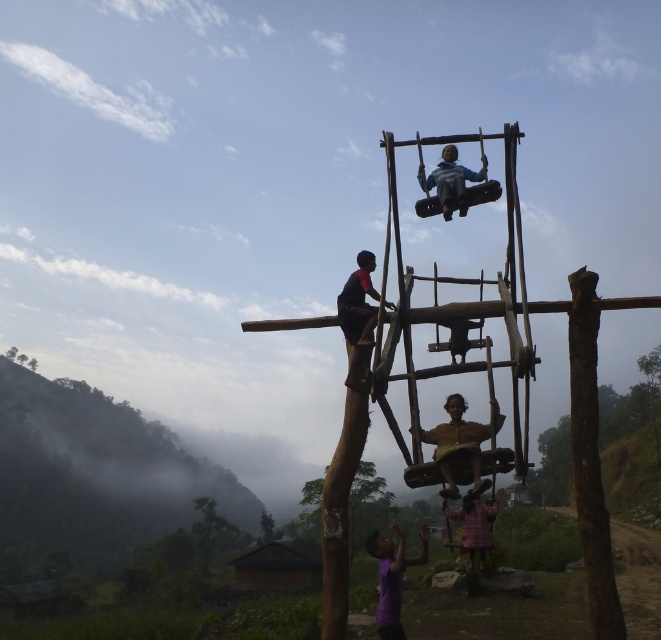
Question: Can you confirm if brown wooden swing at center is thinner than purple matte shirt at lower center?

Choices:
 (A) yes
 (B) no

Answer: (A)

Question: Which point is farther from the camera taking this photo?

Choices:
 (A) (447, 182)
 (B) (440, 454)
 (C) (377, 532)
 (D) (463, 509)

Answer: (D)

Question: Which object is the farthest from the plaid fabric child at lower center?

Choices:
 (A) purple matte shirt at lower center
 (B) brown wooden swing at center

Answer: (B)

Question: In this image, where is brown wooden swing at center located relative to plaid fabric child at lower center?

Choices:
 (A) below
 (B) above

Answer: (B)

Question: Which object is positioned closest to the purple matte shirt at lower center?

Choices:
 (A) blue striped shirt at upper center
 (B) plaid fabric child at lower center

Answer: (B)

Question: Does brown wooden swing at center appear on the left side of purple matte shirt at lower center?

Choices:
 (A) no
 (B) yes

Answer: (A)